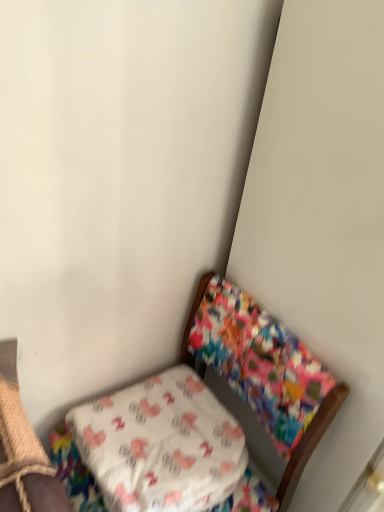
Question: Considering the positions of floral fabric chair at lower right and white fabric pillow at lower left in the image, is floral fabric chair at lower right wider or thinner than white fabric pillow at lower left?

Choices:
 (A) wide
 (B) thin

Answer: (A)

Question: From a real-world perspective, relative to white fabric pillow at lower left, is floral fabric chair at lower right vertically above or below?

Choices:
 (A) above
 (B) below

Answer: (B)

Question: Considering the relative positions of floral fabric chair at lower right and white fabric pillow at lower left in the image provided, is floral fabric chair at lower right to the left or to the right of white fabric pillow at lower left?

Choices:
 (A) right
 (B) left

Answer: (A)

Question: Choose the correct answer: Is white fabric pillow at lower left inside floral fabric chair at lower right or outside it?

Choices:
 (A) inside
 (B) outside

Answer: (A)

Question: In the image, is white fabric pillow at lower left on the left side or the right side of floral fabric chair at lower right?

Choices:
 (A) right
 (B) left

Answer: (B)

Question: From a real-world perspective, is white fabric pillow at lower left above or below floral fabric chair at lower right?

Choices:
 (A) above
 (B) below

Answer: (A)

Question: Is point (158, 377) closer or farther from the camera than point (185, 349)?

Choices:
 (A) farther
 (B) closer

Answer: (B)